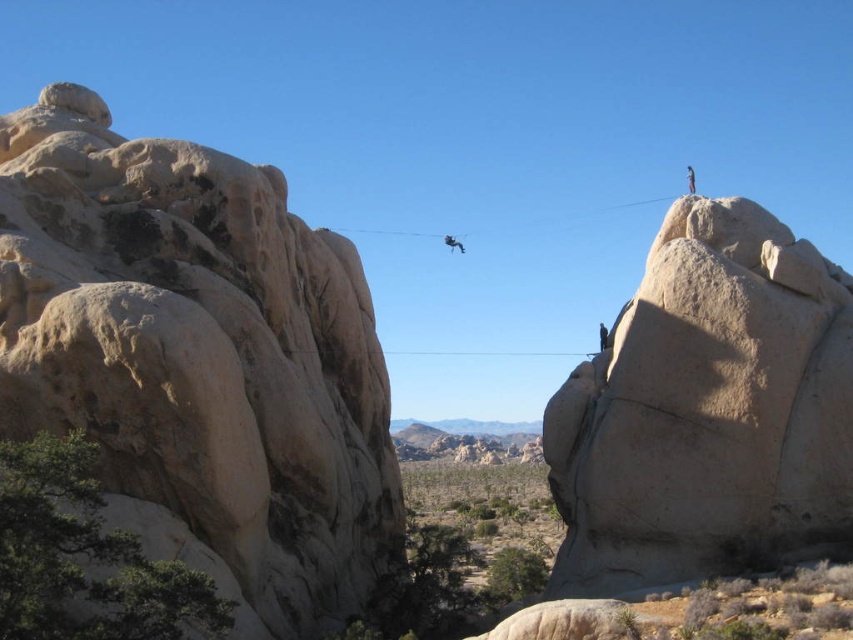
Question: Is beige rough rock at left bigger than smooth beige rock at upper right?

Choices:
 (A) no
 (B) yes

Answer: (B)

Question: Does beige rough rock at left come in front of smooth beige rock at upper right?

Choices:
 (A) yes
 (B) no

Answer: (A)

Question: Is beige rough rock at left thinner than smooth beige rock at upper right?

Choices:
 (A) yes
 (B) no

Answer: (B)